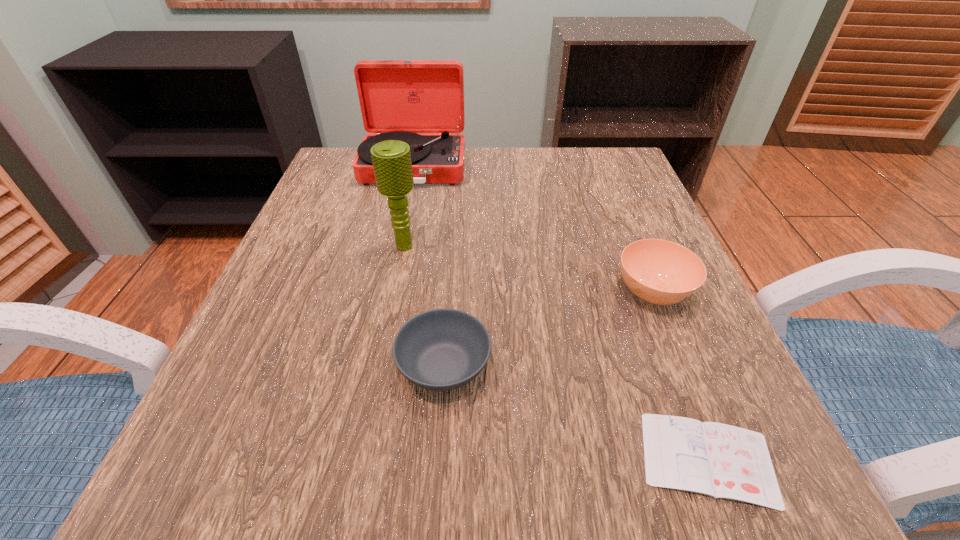
The width and height of the screenshot is (960, 540). I want to click on vacant point at the far edge, so click(492, 160).

Identify the location of free region at the left edge of the desktop. This screenshot has height=540, width=960. (297, 319).

The image size is (960, 540). Identify the location of vacant space at the right edge of the desktop. (665, 363).

Where is `free space at the far left corner of the desktop`? This screenshot has height=540, width=960. free space at the far left corner of the desktop is located at coordinates (326, 170).

I want to click on free region at the near left corner of the desktop, so click(x=160, y=511).

In the image, there is a desktop. Where is `vacant space at the far right corner`? The width and height of the screenshot is (960, 540). vacant space at the far right corner is located at coordinates (610, 172).

Locate an element on the screen. free spot between the left soup bowl and the fourth nearest object is located at coordinates (424, 306).

Where is `free space that is in between the nearest object and the third tallest object`? This screenshot has height=540, width=960. free space that is in between the nearest object and the third tallest object is located at coordinates (681, 376).

Identify the location of vacant point located between the right soup bowl and the shortest object. The image size is (960, 540). (681, 376).

Locate an element on the screen. This screenshot has width=960, height=540. empty space between the farther soup bowl and the fourth tallest object is located at coordinates (548, 329).